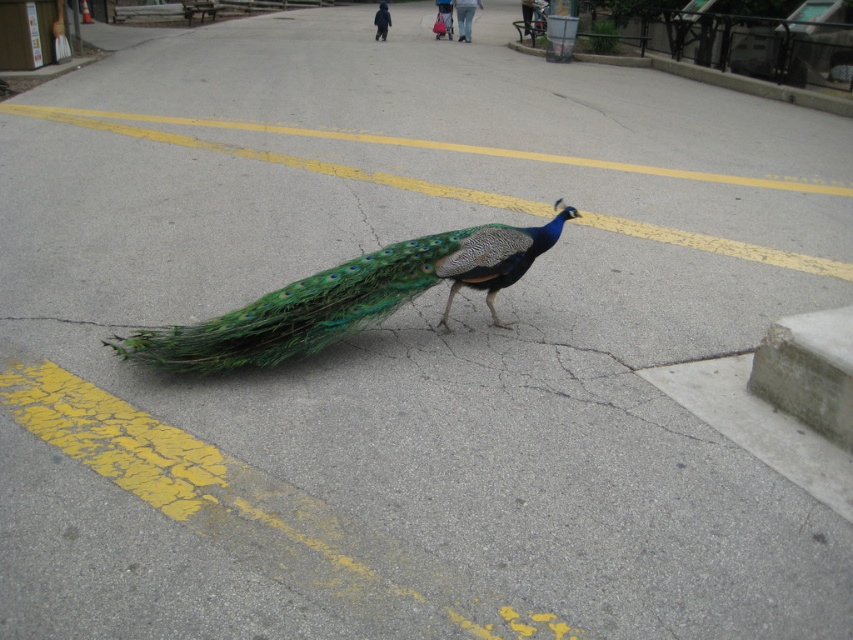
You are a pedestrian standing at the starting point of the yellow double lines on the road. You want to cross the road to the other side. The green iridescent peacock at center is blocking your path. Can you walk around it without stepping on the yellow double lines?

The green iridescent peacock at center is positioned at coordinates point [347,298]. Since the yellow double lines are on the road, you can walk around the peacock either to its left or right while staying on the road outside the yellow lines to reach the other side safely.

You are a photographer trying to capture the green iridescent peacock at center and the gray concrete curb at upper right in a single shot. Which object will appear larger in the photo?

The green iridescent peacock at center will appear larger in the photo because it is bigger than the gray concrete curb at upper right.

You are a delivery driver who needs to pass through the road where the green iridescent peacock at center and the gray concrete curb at upper right are located. Considering the size of the peacock, can your truck, which is 2 meters wide, safely navigate around it without hitting the curb?

The green iridescent peacock at center is wider than the gray concrete curb at upper right. However, the exact width of the peacock isn